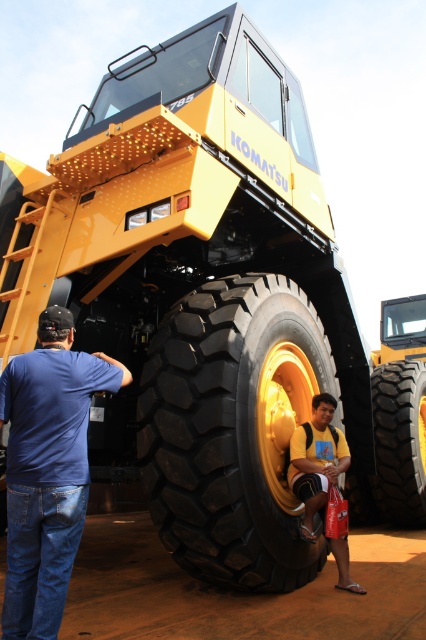
Question: Which point is closer to the camera?

Choices:
 (A) (66, 337)
 (B) (175, 518)

Answer: (A)

Question: Can you confirm if black rubber tire at lower center is positioned to the left of yellow cotton shirt at lower center?

Choices:
 (A) no
 (B) yes

Answer: (A)

Question: Estimate the real-world distances between objects in this image. Which object is closer to the blue denim jeans at lower left?

Choices:
 (A) yellow cotton shirt at lower center
 (B) black rubber tire at lower center
 (C) black rubber tire at center

Answer: (C)

Question: Is black rubber tire at center smaller than black rubber tire at lower center?

Choices:
 (A) yes
 (B) no

Answer: (B)

Question: Estimate the real-world distances between objects in this image. Which object is closer to the yellow cotton shirt at lower center?

Choices:
 (A) black rubber tire at center
 (B) black rubber tire at lower center

Answer: (A)

Question: Is the position of black rubber tire at center less distant than that of yellow cotton shirt at lower center?

Choices:
 (A) no
 (B) yes

Answer: (B)